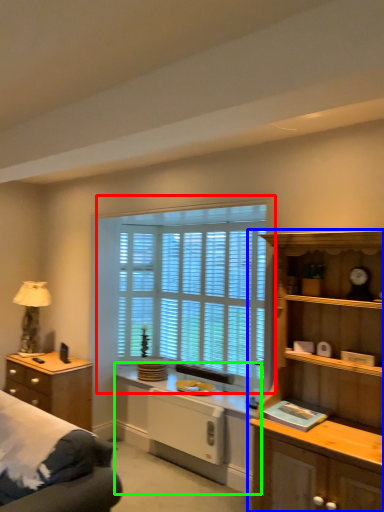
Question: Based on their relative distances, which object is farther from window (highlighted by a red box)? Choose from cabinetry (highlighted by a blue box) and computer desk (highlighted by a green box).

Choices:
 (A) cabinetry
 (B) computer desk

Answer: (A)